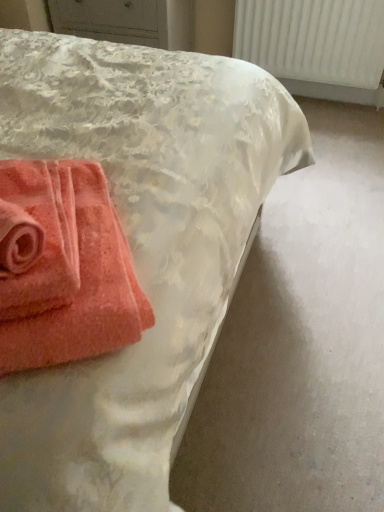
The height and width of the screenshot is (512, 384). Identify the location of free point in front of white textured radiator at upper right. (334, 134).